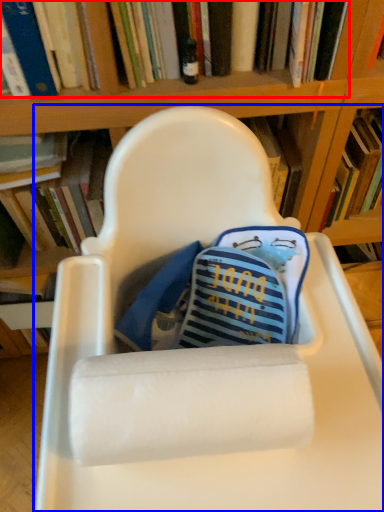
Question: Among these objects, which one is farthest to the camera, book (highlighted by a red box) or chair (highlighted by a blue box)?

Choices:
 (A) book
 (B) chair

Answer: (A)